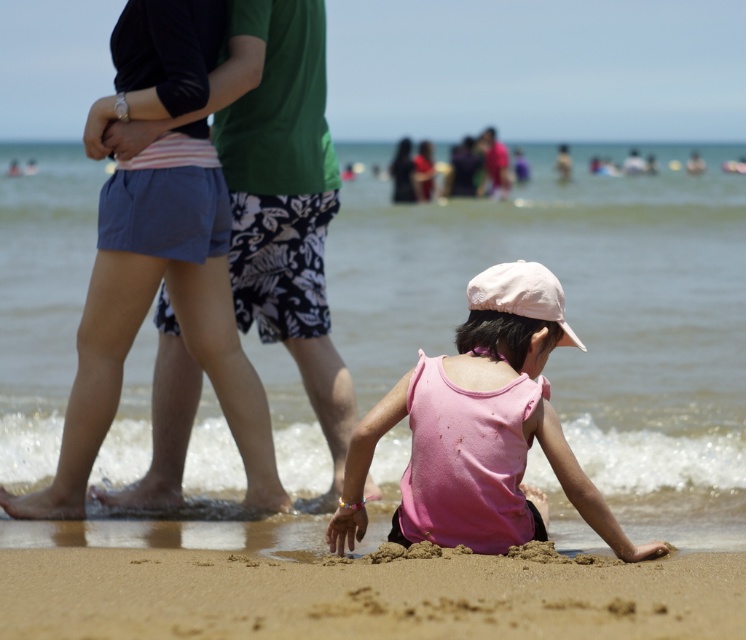
Question: Among these objects, which one is nearest to the camera?

Choices:
 (A) clear water at lower center
 (B) fine-grained sand at lower center

Answer: (B)

Question: Does clear water at lower center have a larger size compared to pink matte tank top at lower center?

Choices:
 (A) no
 (B) yes

Answer: (B)

Question: Estimate the real-world distances between objects in this image. Which object is farther from the matte blue shorts at left?

Choices:
 (A) fine-grained sand at lower center
 (B) pink matte tank top at lower center

Answer: (A)

Question: Is fine-grained sand at lower center positioned at the back of matte blue shorts at left?

Choices:
 (A) no
 (B) yes

Answer: (A)

Question: Which object is positioned closest to the pink matte tank top at lower center?

Choices:
 (A) fine-grained sand at lower center
 (B) clear water at lower center

Answer: (A)

Question: Can you confirm if clear water at lower center is smaller than matte blue shorts at left?

Choices:
 (A) no
 (B) yes

Answer: (A)